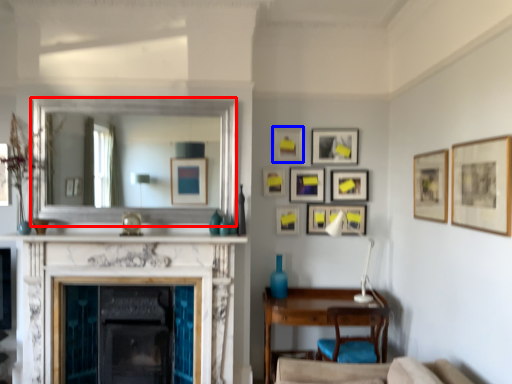
Question: Among these objects, which one is farthest to the camera, mirror (highlighted by a red box) or picture frame (highlighted by a blue box)?

Choices:
 (A) mirror
 (B) picture frame

Answer: (B)